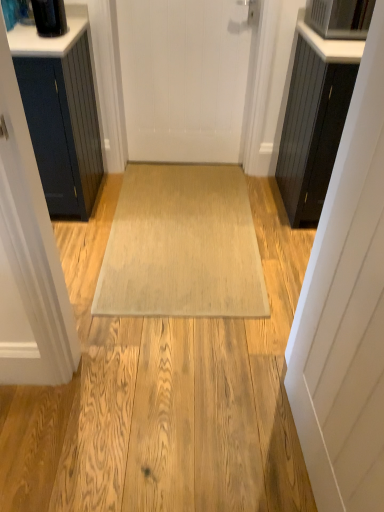
Question: From a real-world perspective, is white matte door at right, which ranks as the first door in bottom-to-top order, below beige woven mat at center?

Choices:
 (A) no
 (B) yes

Answer: (A)

Question: Considering the relative positions of white matte door at right, the first door from the front, and beige woven mat at center in the image provided, is white matte door at right, the first door from the front, to the right of beige woven mat at center from the viewer's perspective?

Choices:
 (A) no
 (B) yes

Answer: (B)

Question: Is white matte door at right, which appears as the second door when viewed from the back, facing towards beige woven mat at center?

Choices:
 (A) yes
 (B) no

Answer: (B)

Question: From the image's perspective, would you say white matte door at right, the first door from the front, is shown under beige woven mat at center?

Choices:
 (A) yes
 (B) no

Answer: (A)

Question: Considering the relative sizes of white matte door at right, which appears as the second door when viewed from the back, and beige woven mat at center in the image provided, is white matte door at right, which appears as the second door when viewed from the back, thinner than beige woven mat at center?

Choices:
 (A) yes
 (B) no

Answer: (A)

Question: Can beige woven mat at center be found inside white matte door at right, the first door from the front?

Choices:
 (A) no
 (B) yes

Answer: (A)

Question: From a real-world perspective, is satin silver microwave at upper right below black glossy container at upper left?

Choices:
 (A) yes
 (B) no

Answer: (B)

Question: Could you tell me if satin silver microwave at upper right is turned towards black glossy container at upper left?

Choices:
 (A) no
 (B) yes

Answer: (A)

Question: Is satin silver microwave at upper right thinner than black glossy container at upper left?

Choices:
 (A) yes
 (B) no

Answer: (B)

Question: Does satin silver microwave at upper right have a greater height compared to black glossy container at upper left?

Choices:
 (A) yes
 (B) no

Answer: (A)

Question: From a real-world perspective, is satin silver microwave at upper right on black glossy container at upper left?

Choices:
 (A) no
 (B) yes

Answer: (B)

Question: Can we say satin silver microwave at upper right lies outside black glossy container at upper left?

Choices:
 (A) yes
 (B) no

Answer: (A)

Question: Considering the relative sizes of black wood cabinet at right and white matte door at right, the first door from the front, in the image provided, is black wood cabinet at right smaller than white matte door at right, the first door from the front,?

Choices:
 (A) no
 (B) yes

Answer: (A)